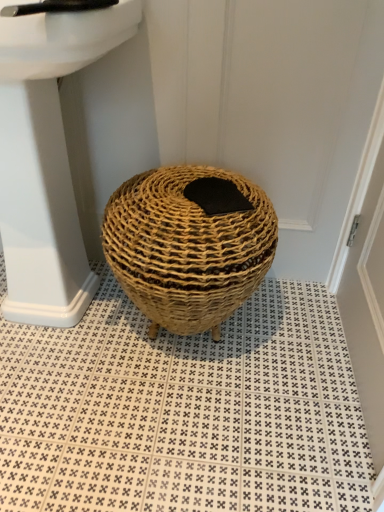
Question: From the image's perspective, is black plastic faucet at upper left positioned above or below white glossy sink at upper left?

Choices:
 (A) above
 (B) below

Answer: (A)

Question: From a real-world perspective, relative to white glossy sink at upper left, is black plastic faucet at upper left vertically above or below?

Choices:
 (A) above
 (B) below

Answer: (A)

Question: Which of these objects is positioned closest to the natural woven basket at center?

Choices:
 (A) natural woven basket at center
 (B) white glossy sink at upper left
 (C) black felt pad at center
 (D) black plastic faucet at upper left

Answer: (A)

Question: Which of these objects is positioned farthest from the black felt pad at center?

Choices:
 (A) natural woven basket at center
 (B) black plastic faucet at upper left
 (C) white glossy sink at upper left
 (D) natural woven basket at center

Answer: (A)